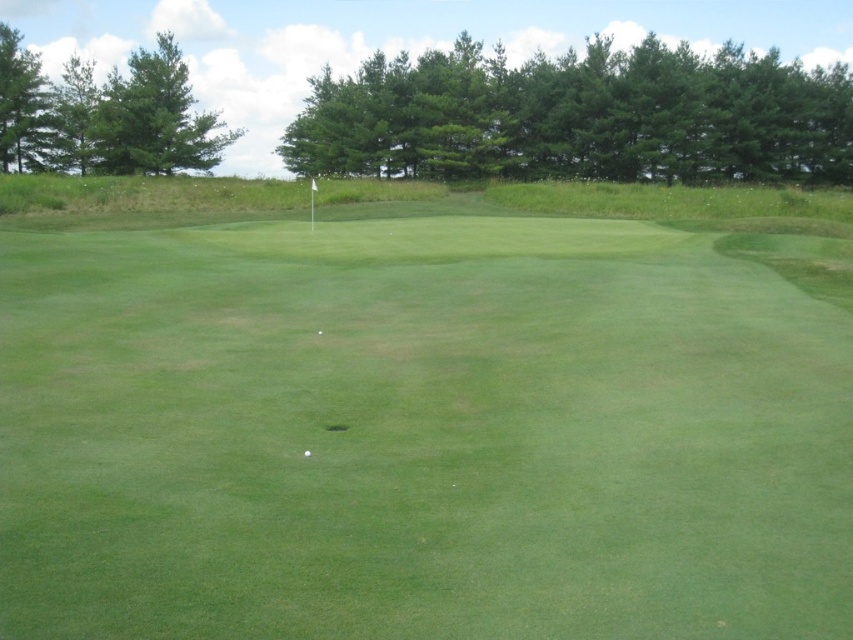
Question: Is green smooth golf ball at center wider than white smooth golf ball at center?

Choices:
 (A) no
 (B) yes

Answer: (A)

Question: Can you confirm if green grassy putting green at center is wider than white smooth golf ball at center?

Choices:
 (A) no
 (B) yes

Answer: (B)

Question: Is green grassy putting green at center bigger than green smooth golf ball at center?

Choices:
 (A) no
 (B) yes

Answer: (B)

Question: Which object is closer to the camera taking this photo?

Choices:
 (A) green smooth golf ball at center
 (B) green grassy putting green at center

Answer: (B)

Question: Which is nearer to the white smooth golf ball at center?

Choices:
 (A) green grassy putting green at center
 (B) green smooth golf ball at center

Answer: (B)

Question: Which object is the closest to the green grassy putting green at center?

Choices:
 (A) green smooth golf ball at center
 (B) white smooth golf ball at center

Answer: (B)